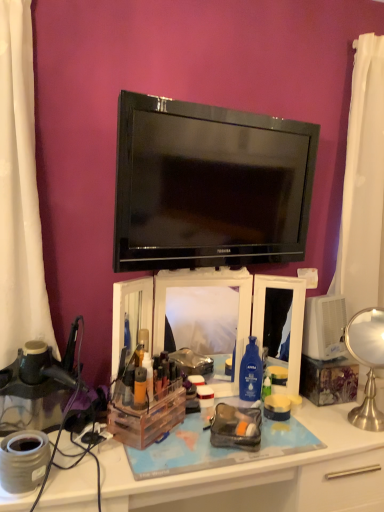
Question: Considering their positions, is clear plastic organizer at center located in front of or behind black glossy tv at center?

Choices:
 (A) behind
 (B) front

Answer: (B)

Question: In terms of width, does clear plastic organizer at center look wider or thinner when compared to black glossy tv at center?

Choices:
 (A) thin
 (B) wide

Answer: (B)

Question: Which object is the closest to the polished silver table lamp at right?

Choices:
 (A) black glossy tv at center
 (B) translucent plastic container at center, placed as the 1th toiletry when sorted from back to front
 (C) clear plastic makeup organizer at center
 (D) clear plastic organizer at center
 (E) matte orange bottle at center, marked as the 2th toiletry in a back-to-front arrangement

Answer: (D)

Question: Which of these objects is positioned closest to the black glossy tv at center?

Choices:
 (A) matte orange bottle at center, which is the first toiletry in front-to-back order
 (B) clear plastic organizer at center
 (C) polished silver table lamp at right
 (D) clear plastic makeup organizer at center
 (E) translucent plastic container at center, placed as the 1th toiletry when sorted from back to front

Answer: (D)